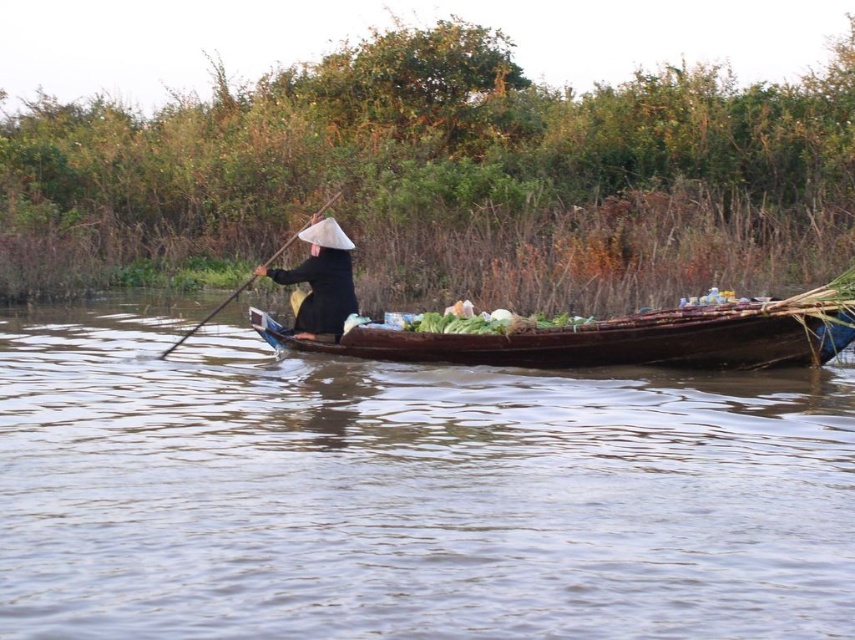
Question: Is brown wooden boat at center closer to camera compared to brown wooden canoe at center?

Choices:
 (A) yes
 (B) no

Answer: (A)

Question: Is brown wooden boat at center to the right of brown wooden canoe at center from the viewer's perspective?

Choices:
 (A) yes
 (B) no

Answer: (B)

Question: Which object is the farthest from the brown wooden canoe at center?

Choices:
 (A) black matte conical hat at center
 (B) wooden smooth paddle at center
 (C) brown wooden boat at center
 (D) green leafy vegetables at center

Answer: (B)

Question: Can you confirm if black matte conical hat at center is positioned to the left of green leafy vegetables at center?

Choices:
 (A) no
 (B) yes

Answer: (B)

Question: Which of the following is the farthest from the observer?

Choices:
 (A) black matte conical hat at center
 (B) wooden smooth paddle at center
 (C) brown wooden boat at center
 (D) brown wooden canoe at center

Answer: (B)

Question: Which object appears farthest from the camera in this image?

Choices:
 (A) green leafy vegetables at center
 (B) black matte conical hat at center

Answer: (B)